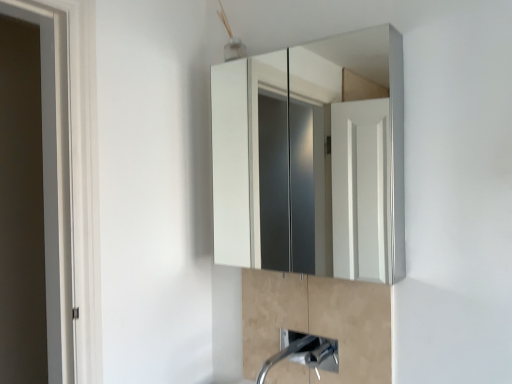
Question: Could satin nickel faucet at lower center be considered to be inside satin nickel faucet at lower center?

Choices:
 (A) no
 (B) yes

Answer: (A)

Question: Does satin nickel faucet at lower center have a larger size compared to satin nickel faucet at lower center?

Choices:
 (A) yes
 (B) no

Answer: (B)

Question: Does satin nickel faucet at lower center lie in front of satin nickel faucet at lower center?

Choices:
 (A) yes
 (B) no

Answer: (B)

Question: Considering the relative sizes of satin nickel faucet at lower center and satin nickel faucet at lower center in the image provided, is satin nickel faucet at lower center smaller than satin nickel faucet at lower center?

Choices:
 (A) yes
 (B) no

Answer: (A)

Question: Is satin nickel faucet at lower center looking in the opposite direction of satin nickel faucet at lower center?

Choices:
 (A) yes
 (B) no

Answer: (A)

Question: From a real-world perspective, is satin nickel faucet at lower center above or below white glossy medicine cabinet at upper center?

Choices:
 (A) below
 (B) above

Answer: (A)

Question: Considering the relative positions of satin nickel faucet at lower center and white glossy medicine cabinet at upper center in the image provided, is satin nickel faucet at lower center to the left or to the right of white glossy medicine cabinet at upper center?

Choices:
 (A) right
 (B) left

Answer: (A)

Question: Is satin nickel faucet at lower center taller or shorter than white glossy medicine cabinet at upper center?

Choices:
 (A) short
 (B) tall

Answer: (A)

Question: From the image's perspective, relative to white glossy medicine cabinet at upper center, is satin nickel faucet at lower center above or below?

Choices:
 (A) below
 (B) above

Answer: (A)

Question: Would you say white glossy medicine cabinet at upper center is inside or outside satin nickel faucet at lower center?

Choices:
 (A) inside
 (B) outside

Answer: (B)

Question: In the image, is white glossy medicine cabinet at upper center positioned in front of or behind satin nickel faucet at lower center?

Choices:
 (A) behind
 (B) front

Answer: (B)

Question: From the image's perspective, is white glossy medicine cabinet at upper center located above or below satin nickel faucet at lower center?

Choices:
 (A) below
 (B) above

Answer: (B)

Question: Looking at their shapes, would you say white glossy medicine cabinet at upper center is wider or thinner than satin nickel faucet at lower center?

Choices:
 (A) wide
 (B) thin

Answer: (B)

Question: Is satin nickel faucet at lower center inside or outside of satin nickel faucet at lower center?

Choices:
 (A) inside
 (B) outside

Answer: (B)

Question: Relative to satin nickel faucet at lower center, is satin nickel faucet at lower center in front or behind?

Choices:
 (A) behind
 (B) front

Answer: (A)